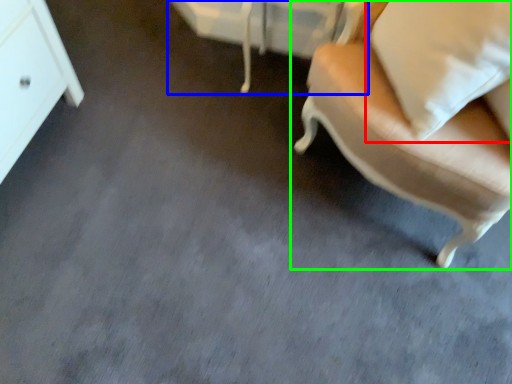
Question: Which is farther away from pillow (highlighted by a red box)? vanity (highlighted by a blue box) or chair (highlighted by a green box)?

Choices:
 (A) vanity
 (B) chair

Answer: (A)